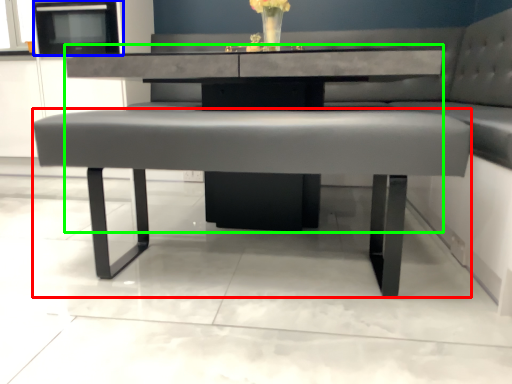
Question: Which object is the farthest from coffee table (highlighted by a red box)? Choose among these: appliance (highlighted by a blue box) or round table (highlighted by a green box).

Choices:
 (A) appliance
 (B) round table

Answer: (A)